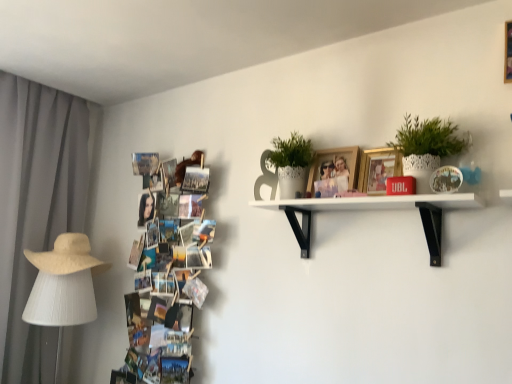
Locate an element on the screen. The width and height of the screenshot is (512, 384). free space above gray fabric curtain at left (from a real-world perspective) is located at coordinates (41, 83).